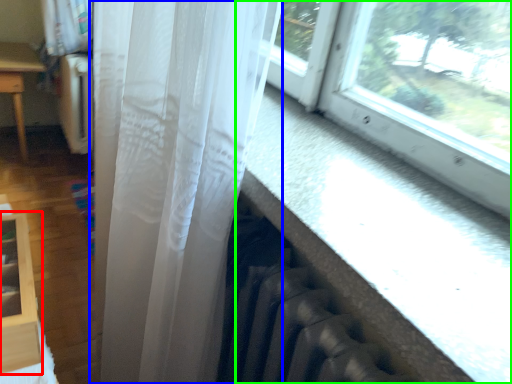
Question: Which is nearer to the shelf (highlighted by a red box)? curtain (highlighted by a blue box) or window (highlighted by a green box).

Choices:
 (A) curtain
 (B) window

Answer: (A)